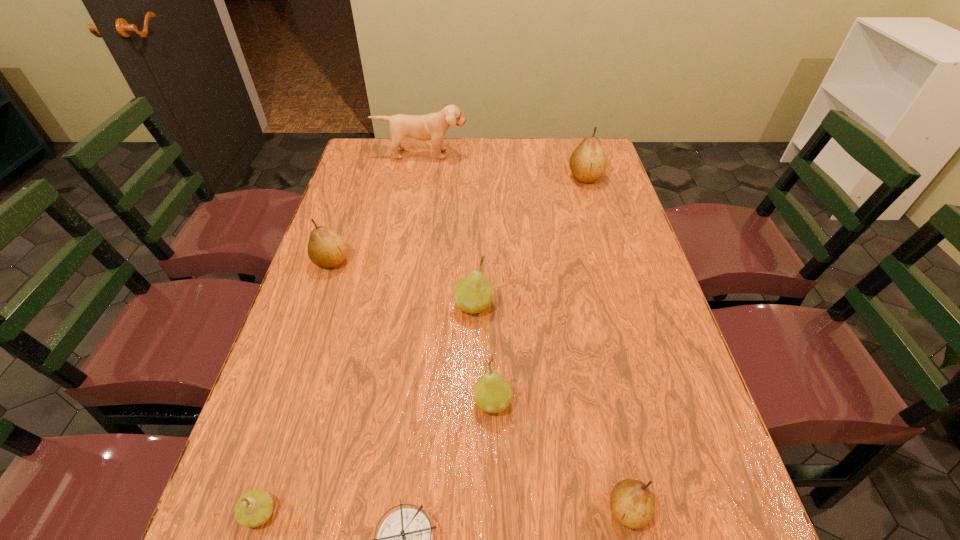
I want to click on brown pear that stands as the closest to the nearest brown pear, so click(327, 249).

Locate which brown pear ranks second in proximity to the second farthest object. Please provide its 2D coordinates. Your answer should be formatted as a tuple, i.e. [(x, y)], where the tuple contains the x and y coordinates of a point satisfying the conditions above.

[(632, 504)]

Where is `green pear that stands as the third closest to the second brown pear from left to right`? green pear that stands as the third closest to the second brown pear from left to right is located at coordinates (253, 509).

Choose which green pear is the second nearest neighbor to the second smallest green pear. Please provide its 2D coordinates. Your answer should be formatted as a tuple, i.e. [(x, y)], where the tuple contains the x and y coordinates of a point satisfying the conditions above.

[(253, 509)]

Identify the location of vacant space that satisfies the following two spatial constraints: 1. on the left side of the farthest brown pear; 2. on the left side of the farthest object. This screenshot has width=960, height=540. (418, 177).

The image size is (960, 540). In order to click on free space that satisfies the following two spatial constraints: 1. on the left side of the beige puppy; 2. on the left side of the fifth pear from left to right in this screenshot , I will do tap(359, 510).

Locate an element on the screen. The image size is (960, 540). vacant position in the image that satisfies the following two spatial constraints: 1. on the back side of the farthest pear; 2. on the right side of the biggest green pear is located at coordinates (475, 177).

Locate an element on the screen. The height and width of the screenshot is (540, 960). free spot that satisfies the following two spatial constraints: 1. on the front side of the second smallest brown pear; 2. on the left side of the leftmost green pear is located at coordinates (247, 513).